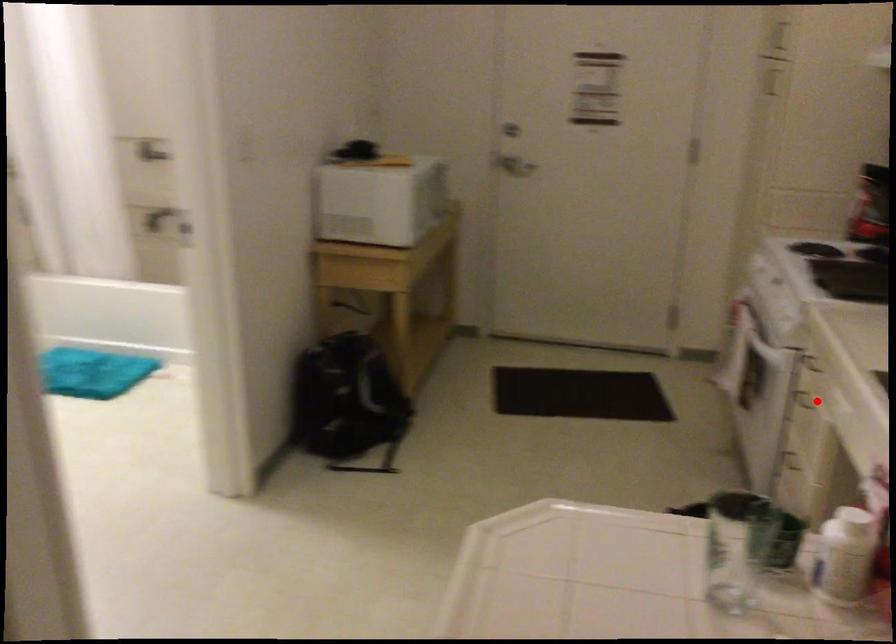
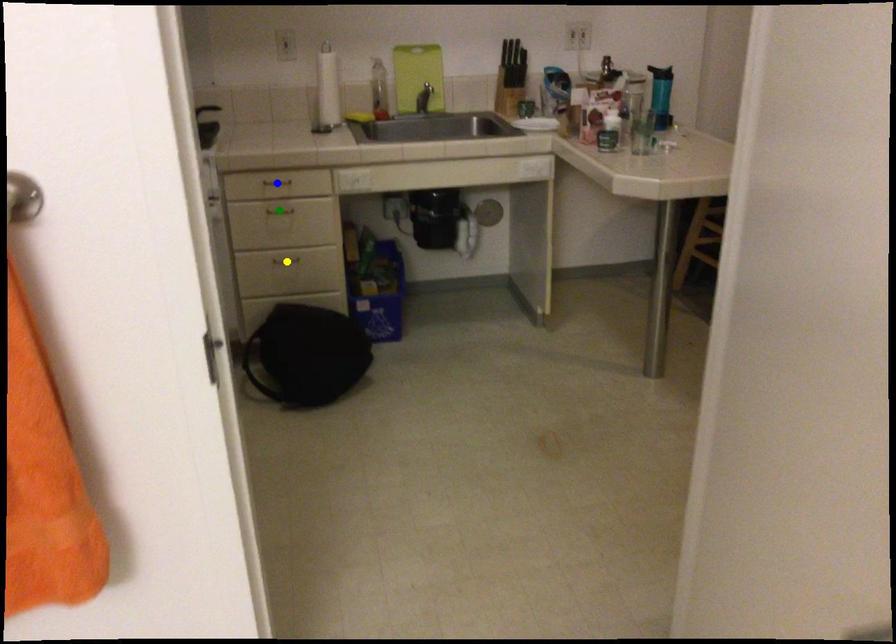
Question: I am providing you with two images of the same scene from different viewpoints. A red point is marked on the first image. You are given multiple points on the second image. Which point in image 2 is actually the same real-world point as the red point in image 1?

Choices:
 (A) green point
 (B) yellow point
 (C) blue point

Answer: (A)